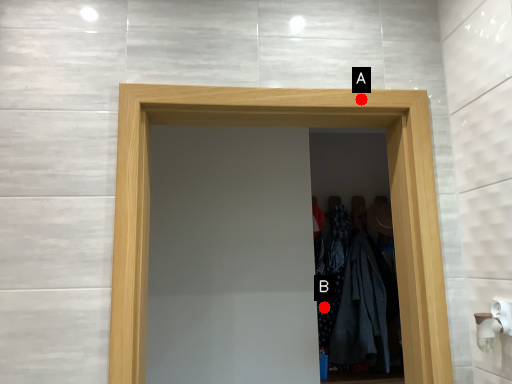
Question: Two points are circled on the image, labeled by A and B beside each circle. Which point appears farthest from the camera in this image?

Choices:
 (A) A is further
 (B) B is further

Answer: (B)